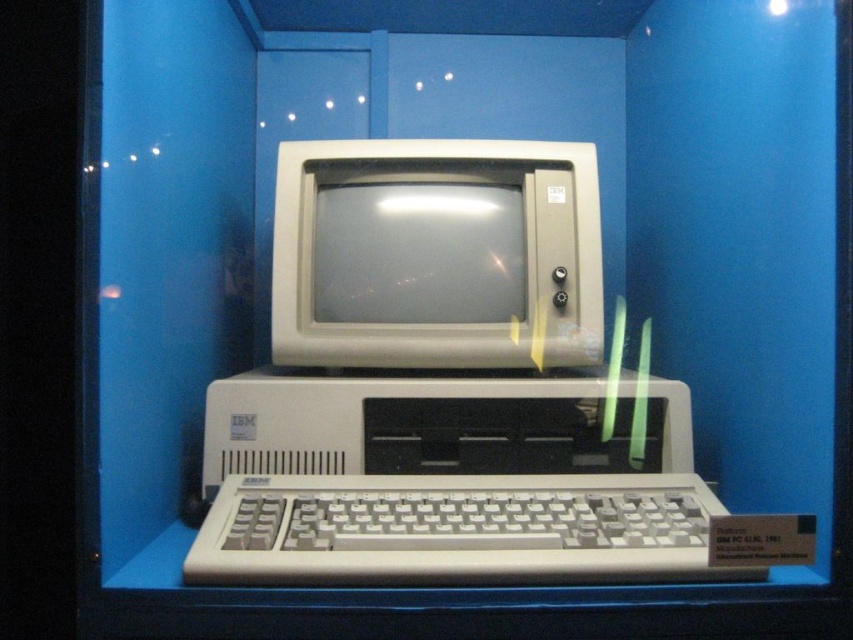
Question: Does matte white desktop computer at center appear under white plastic keyboard at center?

Choices:
 (A) yes
 (B) no

Answer: (B)

Question: Among these objects, which one is farthest from the camera?

Choices:
 (A) white plastic keyboard at center
 (B) matte white desktop computer at center

Answer: (B)

Question: Is matte white desktop computer at center positioned in front of white plastic keyboard at center?

Choices:
 (A) no
 (B) yes

Answer: (A)

Question: Is matte white desktop computer at center wider than white plastic keyboard at center?

Choices:
 (A) no
 (B) yes

Answer: (B)

Question: Which point appears closest to the camera in this image?

Choices:
 (A) (525, 481)
 (B) (421, 240)
 (C) (247, 385)

Answer: (A)

Question: Which object is farther from the camera taking this photo?

Choices:
 (A) white plastic keyboard at center
 (B) beige plastic monitor at center
 (C) matte white desktop computer at center

Answer: (B)